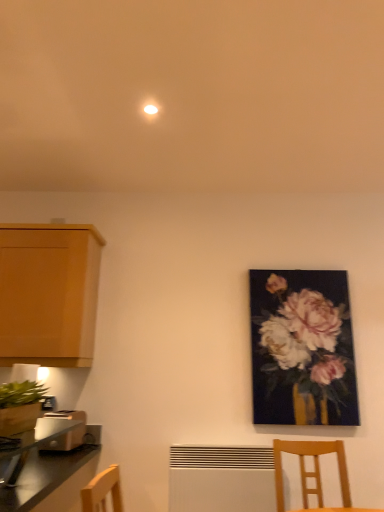
Question: Considering their positions, is light brown plastic toaster at lower left located in front of or behind wooden chair at lower right?

Choices:
 (A) behind
 (B) front

Answer: (A)

Question: From the image's perspective, is light brown plastic toaster at lower left above or below wooden chair at lower right?

Choices:
 (A) above
 (B) below

Answer: (A)

Question: Which object is the closest to the light brown plastic toaster at lower left?

Choices:
 (A) metallic silver toaster at lower left
 (B) white matte radiator at lower center
 (C) wooden cabinet at left
 (D) wooden chair at lower right
 (E) matte floral painting at right

Answer: (A)

Question: Estimate the real-world distances between objects in this image. Which object is closer to the white matte radiator at lower center?

Choices:
 (A) metallic silver toaster at lower left
 (B) wooden chair at lower right
 (C) wooden cabinet at left
 (D) matte floral painting at right
 (E) light brown plastic toaster at lower left

Answer: (B)